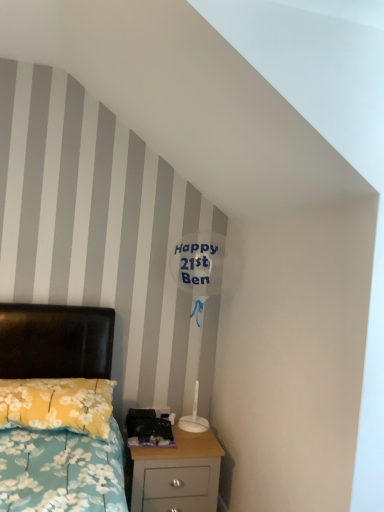
Locate an element on the screen. vacant space underneath transparent plastic balloon at upper center (from a real-world perspective) is located at coordinates (188, 432).